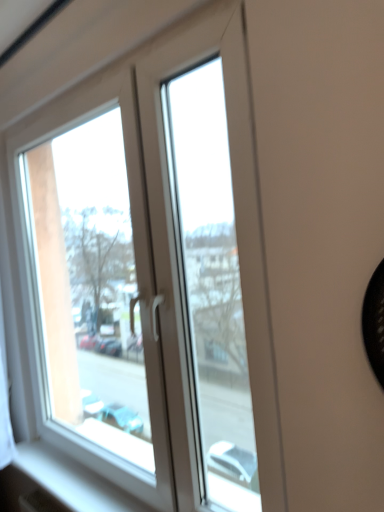
What is the approximate width of white smooth window sill at lower left?

The width of white smooth window sill at lower left is 7.27 inches.

Where is `white smooth window sill at lower left`? This screenshot has width=384, height=512. white smooth window sill at lower left is located at coordinates (72, 480).

This screenshot has width=384, height=512. Describe the element at coordinates (72, 480) in the screenshot. I see `white smooth window sill at lower left` at that location.

Describe the element at coordinates (153, 274) in the screenshot. This screenshot has height=512, width=384. I see `white plastic window at upper left` at that location.

I want to click on white plastic window at upper left, so click(x=153, y=274).

Image resolution: width=384 pixels, height=512 pixels. In order to click on white smooth window sill at lower left in this screenshot , I will do `click(72, 480)`.

Is white plastic window at upper left at the right side of white smooth window sill at lower left?

Indeed, white plastic window at upper left is positioned on the right side of white smooth window sill at lower left.

Who is more distant, white plastic window at upper left or white smooth window sill at lower left?

Positioned behind is white smooth window sill at lower left.

Is point (278, 503) closer to viewer compared to point (102, 503)?

That is True.

Looking at this image, from the image's perspective, is white plastic window at upper left positioned above or below white smooth window sill at lower left?

white plastic window at upper left is above white smooth window sill at lower left.

From a real-world perspective, which is physically below, white plastic window at upper left or white smooth window sill at lower left?

In real-world perspective, white smooth window sill at lower left is lower.

Considering the relative sizes of white plastic window at upper left and white smooth window sill at lower left in the image provided, is white plastic window at upper left wider than white smooth window sill at lower left?

Incorrect, the width of white plastic window at upper left does not surpass that of white smooth window sill at lower left.

Is white plastic window at upper left shorter than white smooth window sill at lower left?

In fact, white plastic window at upper left may be taller than white smooth window sill at lower left.

Is white plastic window at upper left smaller than white smooth window sill at lower left?

A: Incorrect, white plastic window at upper left is not smaller in size than white smooth window sill at lower left.

Is white plastic window at upper left inside or outside of white smooth window sill at lower left?

white plastic window at upper left exists outside the volume of white smooth window sill at lower left.

Are white plastic window at upper left and white smooth window sill at lower left making contact?

They are not placed beside each other.

Is white plastic window at upper left positioned with its back to white smooth window sill at lower left?

white plastic window at upper left does not have its back to white smooth window sill at lower left.

Measure the distance from white plastic window at upper left to white smooth window sill at lower left.

The distance of white plastic window at upper left from white smooth window sill at lower left is 17.90 inches.

This screenshot has height=512, width=384. Find the location of `window sill on the left side of white plastic window at upper left`. window sill on the left side of white plastic window at upper left is located at coordinates (72, 480).

Considering the positions of objects white smooth window sill at lower left and white plastic window at upper left in the image provided, who is more to the left, white smooth window sill at lower left or white plastic window at upper left?

white smooth window sill at lower left is more to the left.

Considering the positions of objects white smooth window sill at lower left and white plastic window at upper left in the image provided, who is behind, white smooth window sill at lower left or white plastic window at upper left?

white smooth window sill at lower left is further away from the camera.

Is point (28, 458) behind point (201, 405)?

No.

From the image's perspective, is white smooth window sill at lower left under white plastic window at upper left?

Yes, from the image's perspective, white smooth window sill at lower left is below white plastic window at upper left.

From a real-world perspective, which is physically above, white smooth window sill at lower left or white plastic window at upper left?

white plastic window at upper left is physically above.

Is white smooth window sill at lower left wider than white plastic window at upper left?

Correct, the width of white smooth window sill at lower left exceeds that of white plastic window at upper left.

Who is taller, white smooth window sill at lower left or white plastic window at upper left?

With more height is white plastic window at upper left.

Between white smooth window sill at lower left and white plastic window at upper left, which one has smaller size?

With smaller size is white smooth window sill at lower left.

Would you say white smooth window sill at lower left is outside white plastic window at upper left?

Yes, white smooth window sill at lower left is not within white plastic window at upper left.

Is white smooth window sill at lower left positioned far away from white plastic window at upper left?

No.

Does white smooth window sill at lower left turn towards white plastic window at upper left?

No, white smooth window sill at lower left does not turn towards white plastic window at upper left.

How different are the orientations of white smooth window sill at lower left and white plastic window at upper left in degrees?

0.545 degrees.

Locate an element on the screen. The image size is (384, 512). window that appears in front of the white smooth window sill at lower left is located at coordinates (153, 274).

Identify the location of window sill below the white plastic window at upper left (from the image's perspective). (72, 480).

You are a GUI agent. You are given a task and a screenshot of the screen. Output one action in this format:
    pyautogui.click(x=<x>, y=<y>)
    Task: Click on the window located above the white smooth window sill at lower left (from the image's perspective)
    The height and width of the screenshot is (512, 384).
    Given the screenshot: What is the action you would take?
    pyautogui.click(x=153, y=274)